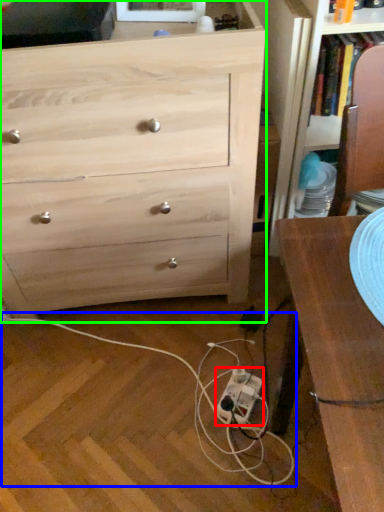
Question: Based on their relative distances, which object is farther from extension cord (highlighted by a red box)? Choose from string (highlighted by a blue box) and chest of drawers (highlighted by a green box).

Choices:
 (A) string
 (B) chest of drawers

Answer: (B)